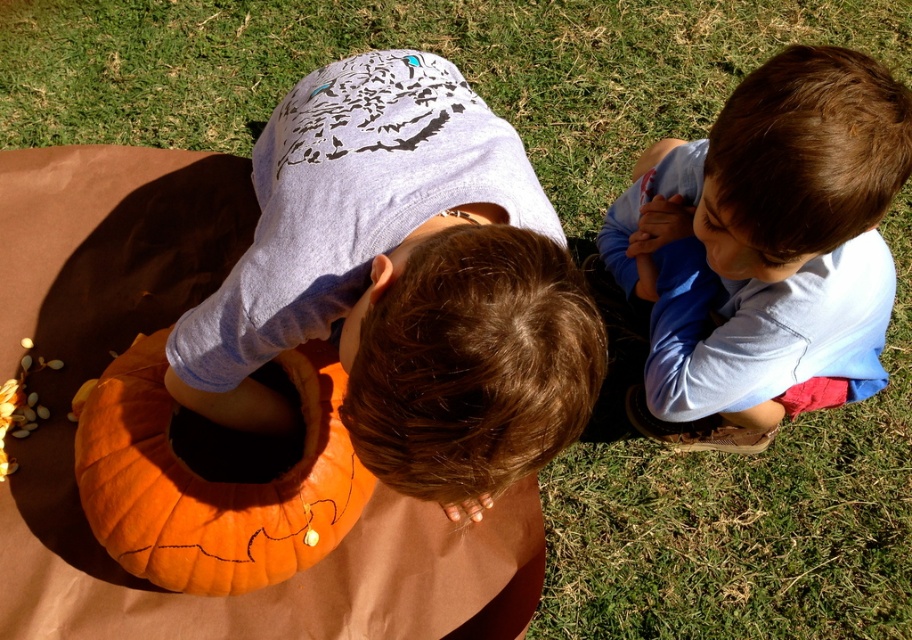
Question: Is matte orange pumpkin at center behind orange matte pumpkin at center?

Choices:
 (A) yes
 (B) no

Answer: (B)

Question: Based on their relative distances, which object is farther from the blue cotton shirt at upper right?

Choices:
 (A) orange matte pumpkin at center
 (B) matte orange pumpkin at center

Answer: (A)

Question: In this image, where is matte orange pumpkin at center located relative to orange matte pumpkin at center?

Choices:
 (A) right
 (B) left

Answer: (A)

Question: Which object appears closest to the camera in this image?

Choices:
 (A) matte orange pumpkin at center
 (B) orange matte pumpkin at center
 (C) blue cotton shirt at upper right

Answer: (A)

Question: Can you confirm if blue cotton shirt at upper right is thinner than orange matte pumpkin at center?

Choices:
 (A) yes
 (B) no

Answer: (B)

Question: Which object is farther from the camera taking this photo?

Choices:
 (A) matte orange pumpkin at center
 (B) blue cotton shirt at upper right

Answer: (B)